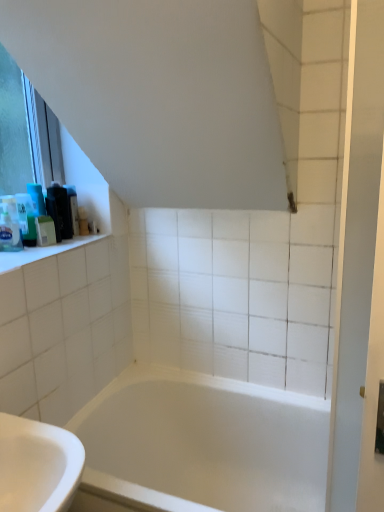
Question: Is white glossy screen door at right wider than black plastic container at upper left, marked as the 4th toiletry in a front-to-back arrangement?

Choices:
 (A) yes
 (B) no

Answer: (B)

Question: From a real-world perspective, is white glossy screen door at right over black plastic container at upper left, marked as the 4th toiletry in a front-to-back arrangement?

Choices:
 (A) no
 (B) yes

Answer: (A)

Question: From a real-world perspective, is white glossy screen door at right positioned under black plastic container at upper left, marked as the 4th toiletry in a front-to-back arrangement, based on gravity?

Choices:
 (A) no
 (B) yes

Answer: (B)

Question: Can you confirm if white glossy screen door at right is positioned to the left of black plastic container at upper left, the second toiletry in the back-to-front sequence?

Choices:
 (A) no
 (B) yes

Answer: (A)

Question: Considering the relative sizes of white glossy screen door at right and black plastic container at upper left, the second toiletry in the back-to-front sequence, in the image provided, is white glossy screen door at right smaller than black plastic container at upper left, the second toiletry in the back-to-front sequence,?

Choices:
 (A) no
 (B) yes

Answer: (A)

Question: From a real-world perspective, is translucent plastic soap at upper left, the fifth toiletry when ordered from back to front, physically located above or below white glossy screen door at right?

Choices:
 (A) above
 (B) below

Answer: (A)

Question: Considering the positions of point (18, 242) and point (344, 333), is point (18, 242) closer or farther from the camera than point (344, 333)?

Choices:
 (A) farther
 (B) closer

Answer: (A)

Question: In terms of size, does translucent plastic soap at upper left, which ranks as the first toiletry in front-to-back order, appear bigger or smaller than white glossy screen door at right?

Choices:
 (A) big
 (B) small

Answer: (B)

Question: Considering their positions, is translucent plastic soap at upper left, which ranks as the first toiletry in front-to-back order, located in front of or behind white glossy screen door at right?

Choices:
 (A) behind
 (B) front

Answer: (A)

Question: From the image's perspective, relative to white glossy bathtub at center, is green matte soap at left, which is the 4th toiletry from back to front, above or below?

Choices:
 (A) below
 (B) above

Answer: (B)

Question: In the image, is green matte soap at left, the 2th toiletry when ordered from front to back, on the left side or the right side of white glossy bathtub at center?

Choices:
 (A) right
 (B) left

Answer: (B)

Question: Considering the positions of green matte soap at left, the 2th toiletry when ordered from front to back, and white glossy bathtub at center in the image, is green matte soap at left, the 2th toiletry when ordered from front to back, bigger or smaller than white glossy bathtub at center?

Choices:
 (A) big
 (B) small

Answer: (B)

Question: Is green matte soap at left, which is the 4th toiletry from back to front, wider or thinner than white glossy bathtub at center?

Choices:
 (A) wide
 (B) thin

Answer: (B)

Question: Is matte black soap dispenser at upper left, which appears as the first toiletry when viewed from the back, wider or thinner than white glossy screen door at right?

Choices:
 (A) thin
 (B) wide

Answer: (A)

Question: Is matte black soap dispenser at upper left, the 5th toiletry in the front-to-back sequence, to the left or to the right of white glossy screen door at right in the image?

Choices:
 (A) right
 (B) left

Answer: (B)